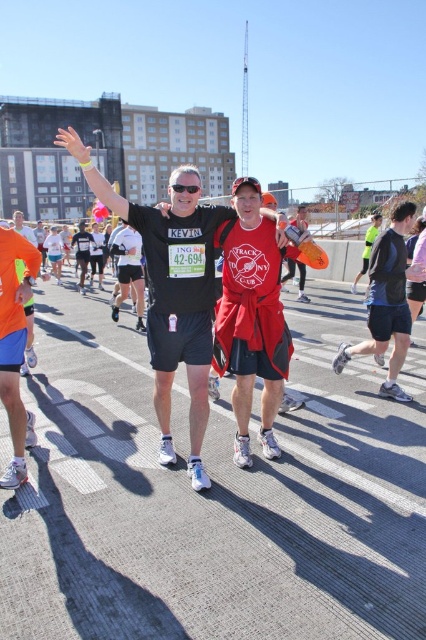
How far apart are matte black t-shirt at center and black matte shorts at right?

The distance of matte black t-shirt at center from black matte shorts at right is 7.62 feet.

Is point (121, 196) positioned before point (397, 365)?

Yes, point (121, 196) is in front of point (397, 365).

The height and width of the screenshot is (640, 426). Find the location of `matte black t-shirt at center`. matte black t-shirt at center is located at coordinates (172, 291).

Looking at this image, can you confirm if red fabric jacket at center is positioned to the right of reflective silver jacket at center?

In fact, red fabric jacket at center is to the left of reflective silver jacket at center.

Does point (287, 278) come behind point (374, 214)?

No, (287, 278) is closer to viewer.

Locate an element on the screen. This screenshot has width=426, height=640. red fabric jacket at center is located at coordinates (299, 276).

Which is more to the left, matte black t-shirt at center or reflective silver jacket at center?

matte black t-shirt at center is more to the left.

Does point (213, 291) lie in front of point (365, 262)?

Yes, point (213, 291) is in front of point (365, 262).

What are the coordinates of `matte black t-shirt at center` in the screenshot? It's located at tap(172, 291).

Image resolution: width=426 pixels, height=640 pixels. What are the coordinates of `matte black t-shirt at center` in the screenshot? It's located at (172, 291).